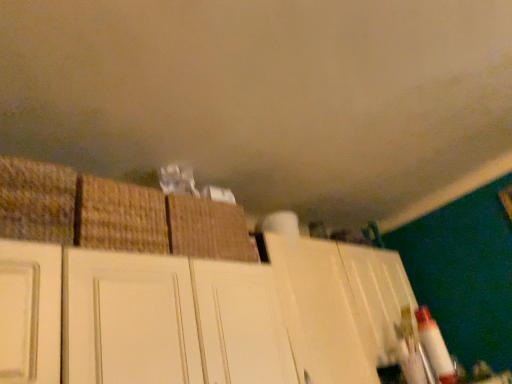
Question: Which direction should I rotate to look at brown woven basket at center, the second basket in the left-to-right sequence?

Choices:
 (A) left
 (B) right

Answer: (A)

Question: Is white matte cabinet at upper center thinner than brown woven basket at center, the second basket in the left-to-right sequence?

Choices:
 (A) yes
 (B) no

Answer: (B)

Question: From the image's perspective, is white matte cabinet at upper center above brown woven basket at center, the second basket in the left-to-right sequence?

Choices:
 (A) no
 (B) yes

Answer: (A)

Question: From a real-world perspective, is white matte cabinet at upper center positioned under brown woven basket at center, the second basket in the left-to-right sequence, based on gravity?

Choices:
 (A) yes
 (B) no

Answer: (A)

Question: From the image's perspective, does white matte cabinet at upper center appear lower than brown woven basket at center, the 2th basket viewed from the right?

Choices:
 (A) no
 (B) yes

Answer: (B)

Question: Can you confirm if white matte cabinet at upper center is taller than brown woven basket at center, the 2th basket viewed from the right?

Choices:
 (A) no
 (B) yes

Answer: (B)

Question: Is the surface of white matte cabinet at upper center in direct contact with brown woven basket at center, the second basket in the left-to-right sequence?

Choices:
 (A) yes
 (B) no

Answer: (B)

Question: Is brown woven basket at center, the 2th basket viewed from the right, to the right of woven straw basket at left, which is the 1th basket from left to right, from the viewer's perspective?

Choices:
 (A) no
 (B) yes

Answer: (B)

Question: Does brown woven basket at center, the 2th basket viewed from the right, have a greater width compared to woven straw basket at left, the third basket in the right-to-left sequence?

Choices:
 (A) no
 (B) yes

Answer: (A)

Question: Considering the relative sizes of brown woven basket at center, the 2th basket viewed from the right, and woven straw basket at left, the third basket in the right-to-left sequence, in the image provided, is brown woven basket at center, the 2th basket viewed from the right, bigger than woven straw basket at left, the third basket in the right-to-left sequence,?

Choices:
 (A) yes
 (B) no

Answer: (A)

Question: Does brown woven basket at center, the 2th basket viewed from the right, come in front of woven straw basket at left, the third basket in the right-to-left sequence?

Choices:
 (A) no
 (B) yes

Answer: (A)

Question: Can you confirm if brown woven basket at center, the second basket in the left-to-right sequence, is smaller than woven straw basket at left, which is the 1th basket from left to right?

Choices:
 (A) no
 (B) yes

Answer: (A)

Question: From the image's perspective, does brown woven basket at center, the 2th basket viewed from the right, appear lower than woven straw basket at left, the third basket in the right-to-left sequence?

Choices:
 (A) yes
 (B) no

Answer: (A)

Question: Is brown woven basket at center, positioned as the 3th basket in left-to-right order, at the left side of woven straw basket at left, the third basket in the right-to-left sequence?

Choices:
 (A) no
 (B) yes

Answer: (A)